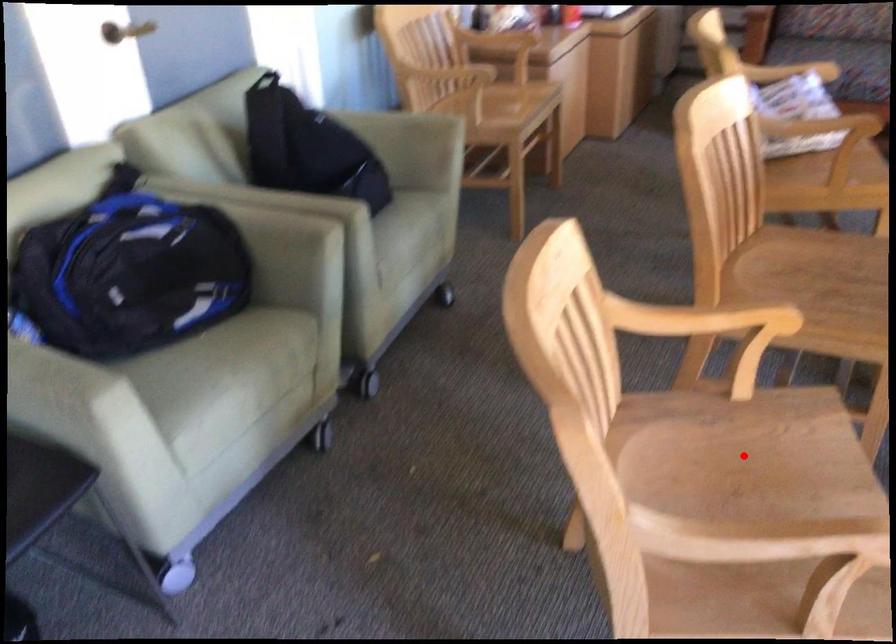
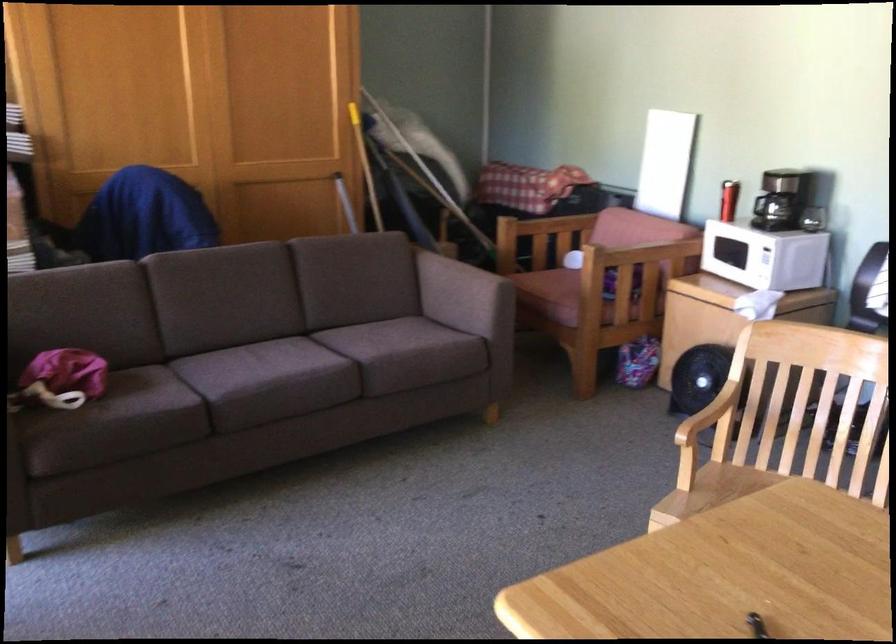
Question: I am providing you with two images of the same scene from different viewpoints. A red point is marked on the first image. Can you still see the location of the red point in image 2?

Choices:
 (A) Yes
 (B) No

Answer: (B)